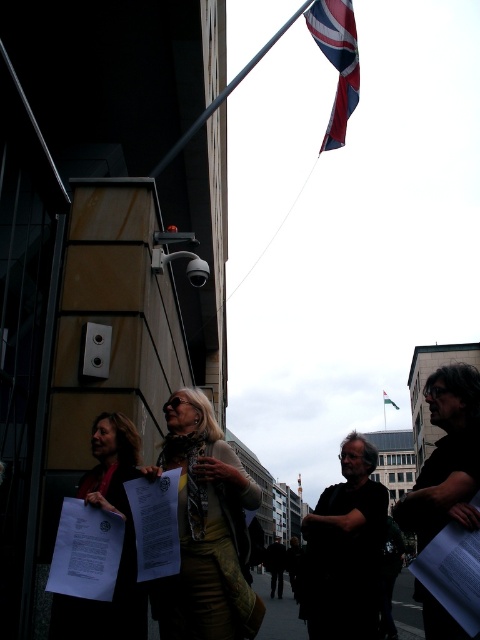
Between white paper at center and metallic pole at upper center, which one has more height?

metallic pole at upper center is taller.

The width and height of the screenshot is (480, 640). What do you see at coordinates (122, 545) in the screenshot? I see `white paper at center` at bounding box center [122, 545].

This screenshot has height=640, width=480. Find the location of `white paper at center`. white paper at center is located at coordinates (122, 545).

What do you see at coordinates (205, 529) in the screenshot? This screenshot has height=640, width=480. I see `gold metallic dress at center` at bounding box center [205, 529].

Can you confirm if gold metallic dress at center is thinner than red and blue fabric flag at upper right?

Correct, gold metallic dress at center's width is less than red and blue fabric flag at upper right's.

This screenshot has height=640, width=480. What are the coordinates of `gold metallic dress at center` in the screenshot? It's located at (205, 529).

Can you confirm if red and blue fabric flag at upper right is bigger than metallic pole at upper center?

Actually, red and blue fabric flag at upper right might be smaller than metallic pole at upper center.

Is red and blue fabric flag at upper right wider than metallic pole at upper center?

In fact, red and blue fabric flag at upper right might be narrower than metallic pole at upper center.

At what (x,y) coordinates should I click in order to perform the action: click on red and blue fabric flag at upper right. Please return your answer as a coordinate pair (x, y). Looking at the image, I should click on (336, 60).